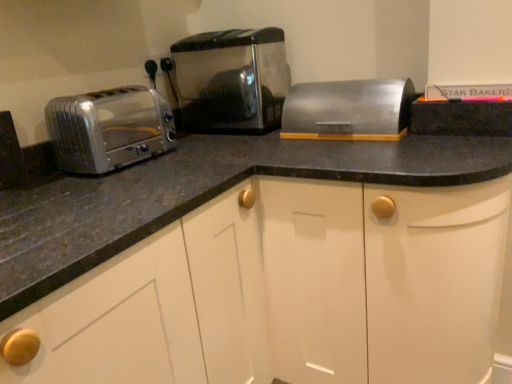
Question: In terms of height, does satin silver breadbox at center look taller or shorter compared to satin silver toaster at left, positioned as the second toaster in right-to-left order?

Choices:
 (A) short
 (B) tall

Answer: (A)

Question: Does point (316, 105) appear closer or farther from the camera than point (168, 122)?

Choices:
 (A) closer
 (B) farther

Answer: (A)

Question: Estimate the real-world distances between objects in this image. Which object is farther from the satin silver breadbox at center?

Choices:
 (A) satin metallic toaster at center, acting as the 1th toaster starting from the right
 (B) satin silver toaster at left, arranged as the 1th toaster when viewed from the left

Answer: (B)

Question: Which object is positioned farthest from the satin silver breadbox at center?

Choices:
 (A) satin silver toaster at left, positioned as the second toaster in right-to-left order
 (B) satin metallic toaster at center, acting as the 1th toaster starting from the right

Answer: (A)